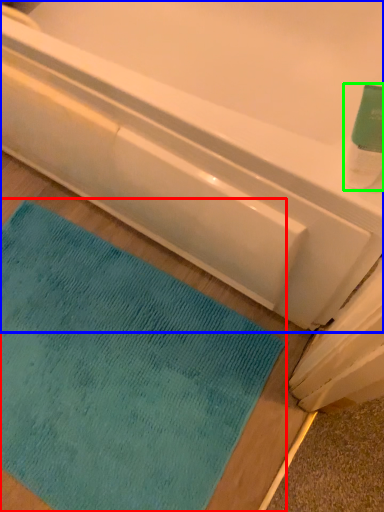
Question: Which is nearer to the mat (highlighted by a red box)? bathtub (highlighted by a blue box) or cleaning product (highlighted by a green box).

Choices:
 (A) bathtub
 (B) cleaning product

Answer: (A)